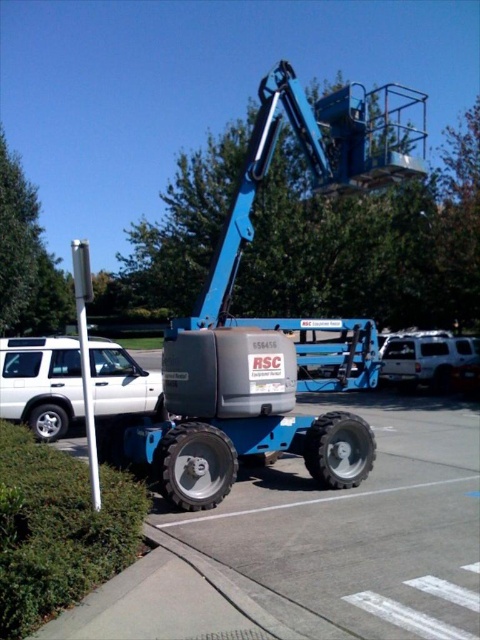
You are a delivery driver who needs to park your truck between the two white matte suv at lower left and white matte suv at right. The truck is 8 meters long. Is there enough space between them to park your truck?

The white matte suv at lower left and white matte suv at right are 10.48 meters apart, so the truck can be parked between them since the space is wider than the truck length of 8 meters.

You are a delivery driver who needs to park your truck in the parking lot shown. You see the white matte suv at lower left and the white matte suv at right. Which SUV is closer to the blue telescopic boom lift parked in the parking lot?

The white matte suv at lower left is closer to the blue telescopic boom lift parked in the parking lot because it is located above the white matte suv at right, meaning it is positioned higher up in the frame and thus nearer to the lift.